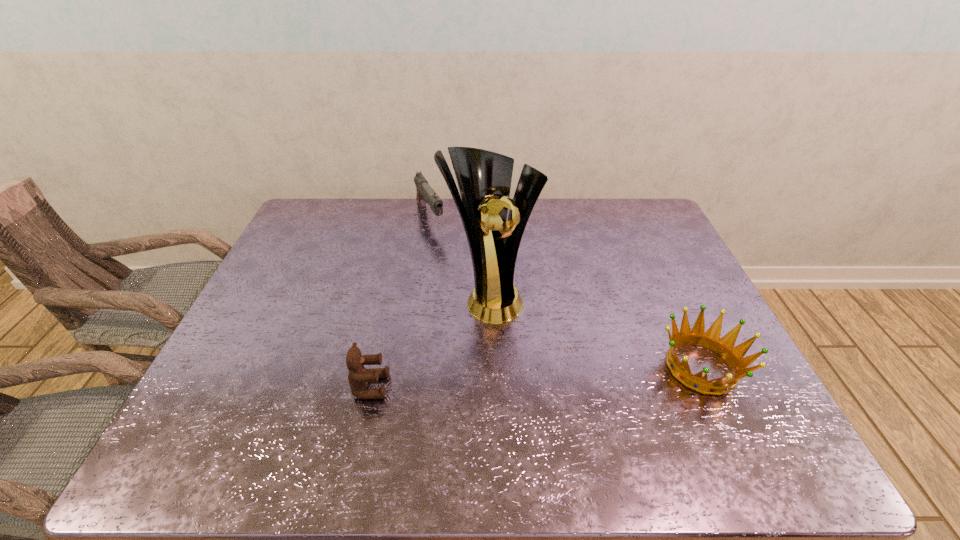
Where is `free space between the third object from left to right and the teddy bear`? The width and height of the screenshot is (960, 540). free space between the third object from left to right and the teddy bear is located at coordinates (431, 341).

Where is `free spot between the teddy bear and the second farthest object`? The image size is (960, 540). free spot between the teddy bear and the second farthest object is located at coordinates (431, 341).

What are the coordinates of `blank region between the rightmost object and the third nearest object` in the screenshot? It's located at pos(596,332).

What are the coordinates of `the third closest object to the gun` in the screenshot? It's located at (711, 339).

Where is `object that is the second closest to the teddy bear`? object that is the second closest to the teddy bear is located at coordinates (425, 194).